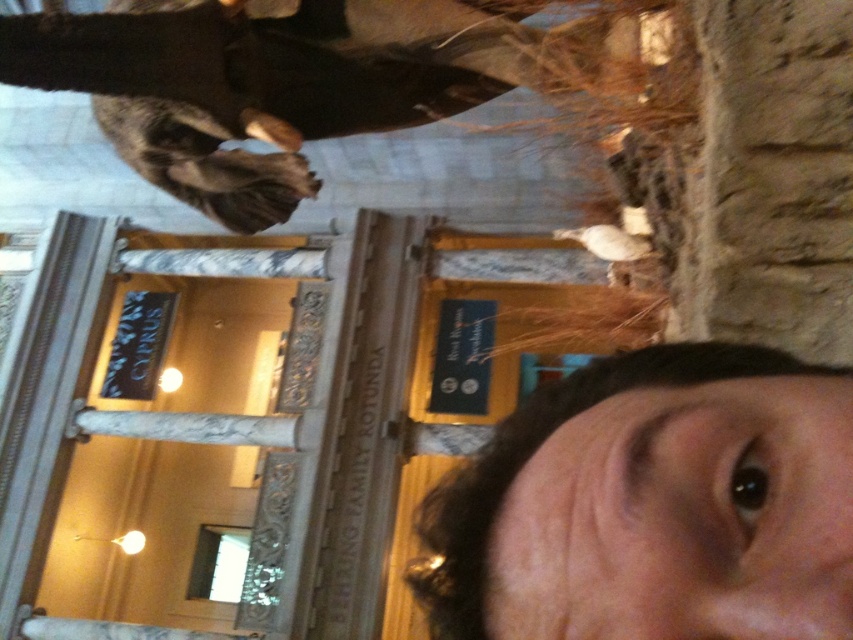
Question: Can you confirm if smooth skin face at lower right is thinner than shiny black coat at upper center?

Choices:
 (A) no
 (B) yes

Answer: (B)

Question: Which point is closer to the camera?

Choices:
 (A) smooth skin face at lower right
 (B) shiny black coat at upper center

Answer: (A)

Question: Which point is closer to the camera taking this photo?

Choices:
 (A) (286, 83)
 (B) (635, 490)

Answer: (B)

Question: Can you confirm if smooth skin face at lower right is bigger than shiny black coat at upper center?

Choices:
 (A) no
 (B) yes

Answer: (A)

Question: Does smooth skin face at lower right have a greater width compared to shiny black coat at upper center?

Choices:
 (A) yes
 (B) no

Answer: (B)

Question: Among these points, which one is nearest to the camera?

Choices:
 (A) (463, 500)
 (B) (113, 115)

Answer: (A)